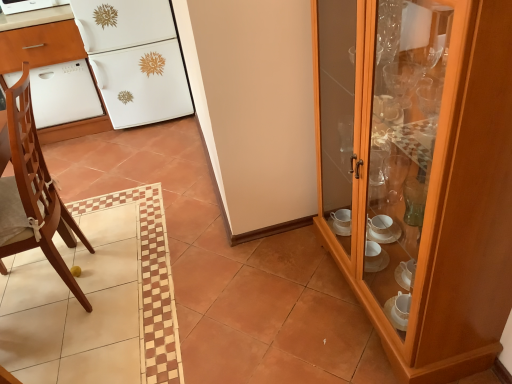
Question: Does white glossy dishwasher at left have a lesser height compared to light brown wooden chair at left?

Choices:
 (A) no
 (B) yes

Answer: (B)

Question: Is white glossy dishwasher at left next to light brown wooden chair at left?

Choices:
 (A) no
 (B) yes

Answer: (A)

Question: Is white glossy dishwasher at left at the left side of light brown wooden chair at left?

Choices:
 (A) no
 (B) yes

Answer: (B)

Question: Is light brown wooden chair at left at the back of white glossy dishwasher at left?

Choices:
 (A) no
 (B) yes

Answer: (A)

Question: Does white glossy dishwasher at left have a smaller size compared to light brown wooden chair at left?

Choices:
 (A) no
 (B) yes

Answer: (A)

Question: Considering the positions of white glossy dishwasher at upper left and white glossy oven at left in the image, is white glossy dishwasher at upper left taller or shorter than white glossy oven at left?

Choices:
 (A) tall
 (B) short

Answer: (B)

Question: From the image's perspective, is white glossy dishwasher at upper left positioned above or below white glossy oven at left?

Choices:
 (A) below
 (B) above

Answer: (B)

Question: Is point (24, 8) closer or farther from the camera than point (78, 89)?

Choices:
 (A) closer
 (B) farther

Answer: (A)

Question: Do you think white glossy dishwasher at upper left is within white glossy oven at left, or outside of it?

Choices:
 (A) inside
 (B) outside

Answer: (B)

Question: From a real-world perspective, is white glossy refrigerator at upper left physically located above or below white glossy oven at left?

Choices:
 (A) below
 (B) above

Answer: (B)

Question: Is white glossy refrigerator at upper left in front of or behind white glossy oven at left in the image?

Choices:
 (A) front
 (B) behind

Answer: (A)

Question: Considering the relative positions of white glossy refrigerator at upper left and white glossy oven at left in the image provided, is white glossy refrigerator at upper left to the left or to the right of white glossy oven at left?

Choices:
 (A) right
 (B) left

Answer: (A)

Question: Looking at the image, does white glossy refrigerator at upper left seem bigger or smaller compared to white glossy oven at left?

Choices:
 (A) big
 (B) small

Answer: (A)

Question: Does point (69, 33) appear closer or farther from the camera than point (500, 16)?

Choices:
 (A) closer
 (B) farther

Answer: (B)

Question: Considering the positions of white glossy dishwasher at left and wooden cabinet at right in the image, is white glossy dishwasher at left taller or shorter than wooden cabinet at right?

Choices:
 (A) tall
 (B) short

Answer: (B)